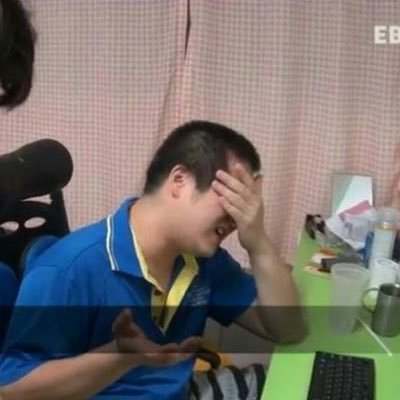
Identify the location of table top. (304, 370).